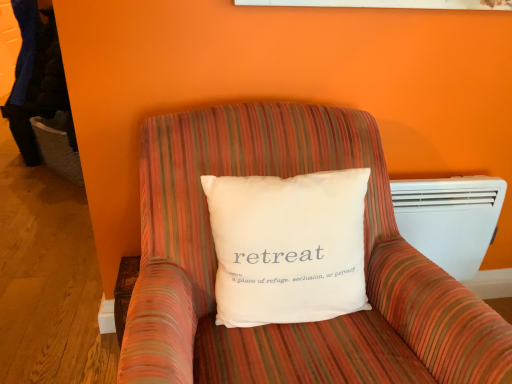
Question: Considering the relative positions of white cotton pillow at center and striped fabric armchair at center in the image provided, is white cotton pillow at center behind striped fabric armchair at center?

Choices:
 (A) no
 (B) yes

Answer: (B)

Question: Does white cotton pillow at center have a lesser height compared to striped fabric armchair at center?

Choices:
 (A) no
 (B) yes

Answer: (B)

Question: Is striped fabric armchair at center located within white cotton pillow at center?

Choices:
 (A) yes
 (B) no

Answer: (B)

Question: Is white cotton pillow at center positioned far away from striped fabric armchair at center?

Choices:
 (A) no
 (B) yes

Answer: (A)

Question: Is white cotton pillow at center outside striped fabric armchair at center?

Choices:
 (A) yes
 (B) no

Answer: (B)

Question: Is point (470, 274) positioned closer to the camera than point (188, 362)?

Choices:
 (A) farther
 (B) closer

Answer: (A)

Question: Is white plastic heater at right wider or thinner than striped fabric armchair at center?

Choices:
 (A) wide
 (B) thin

Answer: (B)

Question: From the image's perspective, is white plastic heater at right located above or below striped fabric armchair at center?

Choices:
 (A) below
 (B) above

Answer: (B)

Question: Is white plastic heater at right inside the boundaries of striped fabric armchair at center, or outside?

Choices:
 (A) outside
 (B) inside

Answer: (A)

Question: In the image, is white plastic heater at right on the left side or the right side of white cotton pillow at center?

Choices:
 (A) left
 (B) right

Answer: (B)

Question: Is point (445, 188) closer or farther from the camera than point (330, 296)?

Choices:
 (A) closer
 (B) farther

Answer: (B)

Question: Is white plastic heater at right inside or outside of white cotton pillow at center?

Choices:
 (A) inside
 (B) outside

Answer: (B)

Question: Considering the positions of white plastic heater at right and white cotton pillow at center in the image, is white plastic heater at right bigger or smaller than white cotton pillow at center?

Choices:
 (A) big
 (B) small

Answer: (B)

Question: Is point (291, 274) positioned closer to the camera than point (301, 165)?

Choices:
 (A) farther
 (B) closer

Answer: (B)

Question: Is white cotton pillow at center in front of or behind striped fabric armchair at center in the image?

Choices:
 (A) front
 (B) behind

Answer: (B)